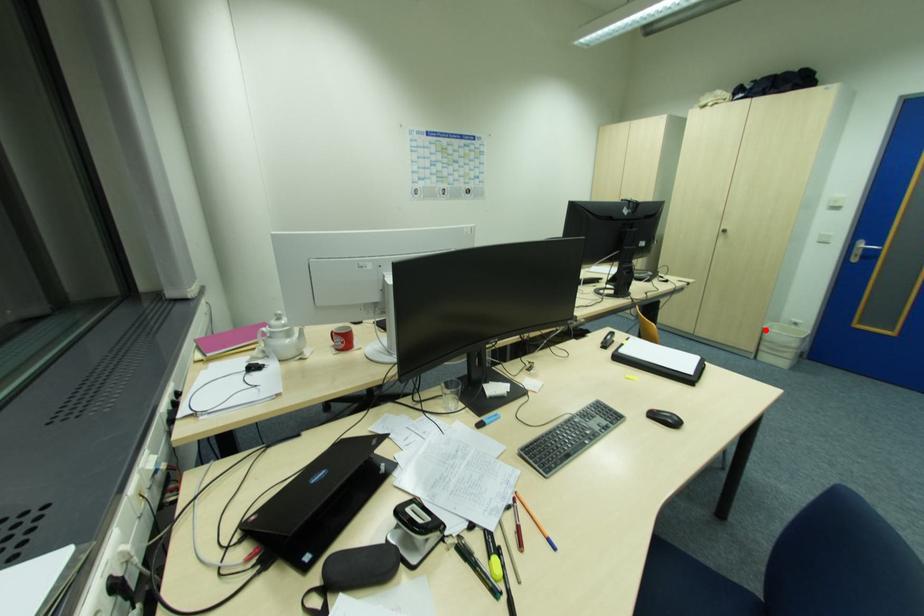
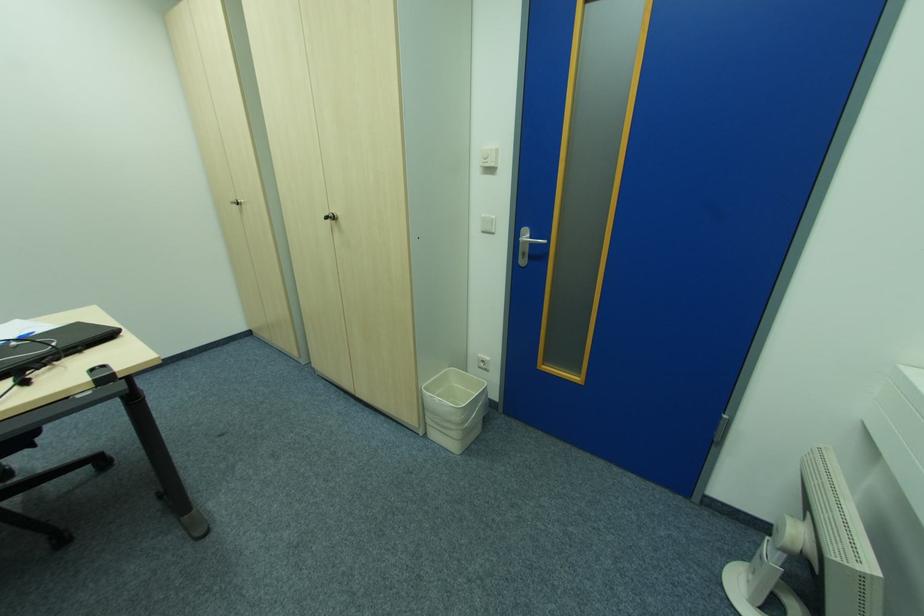
The point at the highlighted location is marked in the first image. Where is the corresponding point in the second image?

(424, 391)